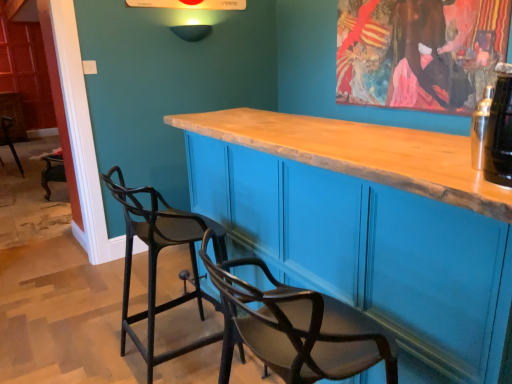
Question: Is black glass bottle at upper right next to wooden cabinet at center?

Choices:
 (A) no
 (B) yes

Answer: (A)

Question: Does black glass bottle at upper right have a larger size compared to wooden cabinet at center?

Choices:
 (A) no
 (B) yes

Answer: (A)

Question: Can you confirm if black glass bottle at upper right is positioned to the right of wooden cabinet at center?

Choices:
 (A) yes
 (B) no

Answer: (A)

Question: Is the depth of black glass bottle at upper right less than that of wooden cabinet at center?

Choices:
 (A) yes
 (B) no

Answer: (B)

Question: Is black glass bottle at upper right outside of wooden cabinet at center?

Choices:
 (A) yes
 (B) no

Answer: (A)

Question: Is black matte chair at left, which is the 2th chair from back to front, in front of or behind black matte chair at left, which is the 2th chair in right-to-left order, in the image?

Choices:
 (A) behind
 (B) front

Answer: (B)

Question: From the image's perspective, is black matte chair at left, positioned as the first chair in right-to-left order, above or below black matte chair at left, the second chair from the front?

Choices:
 (A) below
 (B) above

Answer: (A)

Question: From a real-world perspective, is black matte chair at left, which is the 2th chair from back to front, physically located above or below black matte chair at left, the first chair in the left-to-right sequence?

Choices:
 (A) above
 (B) below

Answer: (A)

Question: Is black matte chair at left, the second chair viewed from the left, inside the boundaries of black matte chair at left, which ranks as the second chair in bottom-to-top order, or outside?

Choices:
 (A) inside
 (B) outside

Answer: (B)

Question: Relative to wooden cabinet at center, is black matte chair at left, the second chair from the front, in front or behind?

Choices:
 (A) front
 (B) behind

Answer: (B)

Question: Is black matte chair at left, which ranks as the second chair in bottom-to-top order, bigger or smaller than wooden cabinet at center?

Choices:
 (A) big
 (B) small

Answer: (B)

Question: Is black matte chair at left, which ranks as the second chair in bottom-to-top order, spatially inside wooden cabinet at center, or outside of it?

Choices:
 (A) inside
 (B) outside

Answer: (B)

Question: Is black matte chair at left, which is counted as the 1th chair, starting from the back, to the left or to the right of wooden cabinet at center in the image?

Choices:
 (A) left
 (B) right

Answer: (A)

Question: Is black matte chair at left, the first chair in the left-to-right sequence, inside or outside of black matte chair at left, acting as the 2th chair starting from the top?

Choices:
 (A) inside
 (B) outside

Answer: (B)

Question: Is black matte chair at left, positioned as the 1th chair in top-to-bottom order, bigger or smaller than black matte chair at left, which is the 2th chair from back to front?

Choices:
 (A) small
 (B) big

Answer: (B)